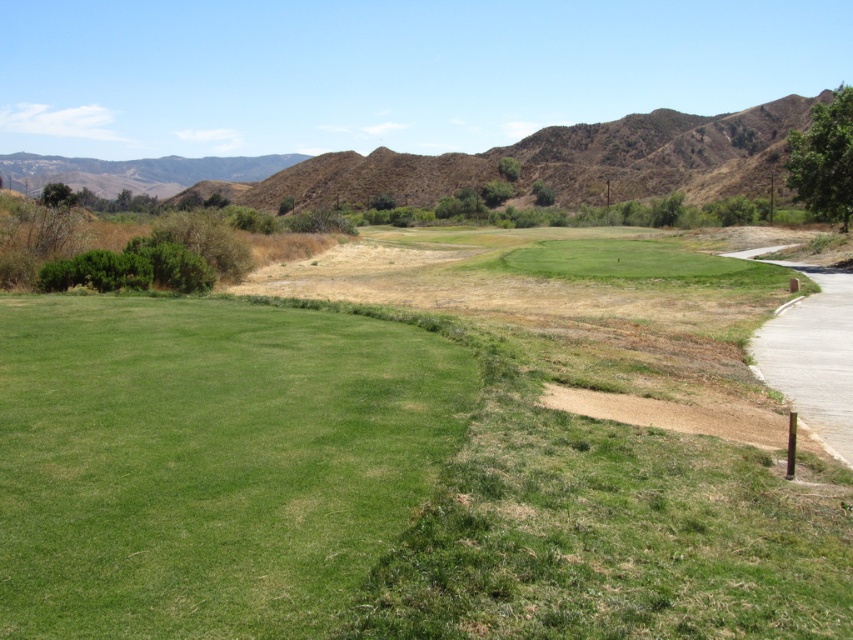
Question: Which of the following is the farthest from the observer?

Choices:
 (A) green grass at center
 (B) brown/dry grassy hill at upper center

Answer: (B)

Question: Which of these objects is positioned closest to the green grass at center?

Choices:
 (A) green grassy golf course at center
 (B) brown/dry grassy hill at upper center

Answer: (A)

Question: Does green grass at center appear on the left side of brown/dry grassy hill at upper center?

Choices:
 (A) no
 (B) yes

Answer: (A)

Question: Can you confirm if green grassy golf course at center is positioned to the left of brown/dry grassy hill at upper center?

Choices:
 (A) yes
 (B) no

Answer: (B)

Question: Which of the following is the farthest from the observer?

Choices:
 (A) green grassy golf course at center
 (B) green grass at center
 (C) brown/dry grassy hill at upper center

Answer: (C)

Question: Is green grass at center to the right of brown/dry grassy hill at upper center from the viewer's perspective?

Choices:
 (A) no
 (B) yes

Answer: (B)